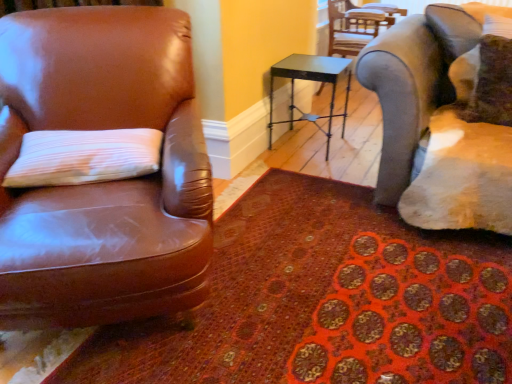
Question: Would you say white textured pillow at left, positioned as the 2th pillow in right-to-left order, is a long distance from velvet brown pillow at upper right, positioned as the 2th pillow in bottom-to-top order?

Choices:
 (A) yes
 (B) no

Answer: (A)

Question: Considering the relative sizes of white textured pillow at left, positioned as the 2th pillow in right-to-left order, and velvet brown pillow at upper right, the 1th pillow in the back-to-front sequence, in the image provided, is white textured pillow at left, positioned as the 2th pillow in right-to-left order, shorter than velvet brown pillow at upper right, the 1th pillow in the back-to-front sequence,?

Choices:
 (A) no
 (B) yes

Answer: (B)

Question: Does white textured pillow at left, which is the 1th pillow in front-to-back order, touch velvet brown pillow at upper right, which appears as the first pillow when viewed from the right?

Choices:
 (A) no
 (B) yes

Answer: (A)

Question: Is white textured pillow at left, the second pillow in the back-to-front sequence, to the left of velvet brown pillow at upper right, positioned as the 1th pillow in top-to-bottom order, from the viewer's perspective?

Choices:
 (A) no
 (B) yes

Answer: (B)

Question: From the image's perspective, is white textured pillow at left, arranged as the second pillow when viewed from the top, located above velvet brown pillow at upper right, placed as the 2th pillow when sorted from left to right?

Choices:
 (A) yes
 (B) no

Answer: (B)

Question: From the image's perspective, is white textured pillow at left, positioned as the 1th pillow in left-to-right order, below velvet brown pillow at upper right, the 1th pillow in the back-to-front sequence?

Choices:
 (A) yes
 (B) no

Answer: (A)

Question: Is patterned carpet at lower left far from metallic gray chair at upper right, the 1th chair viewed from the top?

Choices:
 (A) no
 (B) yes

Answer: (B)

Question: Is patterned carpet at lower left not within metallic gray chair at upper right, acting as the first chair starting from the right?

Choices:
 (A) yes
 (B) no

Answer: (A)

Question: Is patterned carpet at lower left facing away from metallic gray chair at upper right, the 2th chair ordered from the bottom?

Choices:
 (A) yes
 (B) no

Answer: (B)

Question: Is patterned carpet at lower left bigger than metallic gray chair at upper right, the 2th chair from the front?

Choices:
 (A) no
 (B) yes

Answer: (A)

Question: Is metallic gray chair at upper right, the 2th chair positioned from the left, surrounded by patterned carpet at lower left?

Choices:
 (A) yes
 (B) no

Answer: (B)

Question: Considering the relative sizes of patterned carpet at lower left and metallic gray chair at upper right, the 2th chair ordered from the bottom, in the image provided, is patterned carpet at lower left taller than metallic gray chair at upper right, the 2th chair ordered from the bottom,?

Choices:
 (A) no
 (B) yes

Answer: (A)

Question: Can you see metallic gray chair at upper right, the 2th chair from the front, touching metallic black table at center?

Choices:
 (A) yes
 (B) no

Answer: (B)